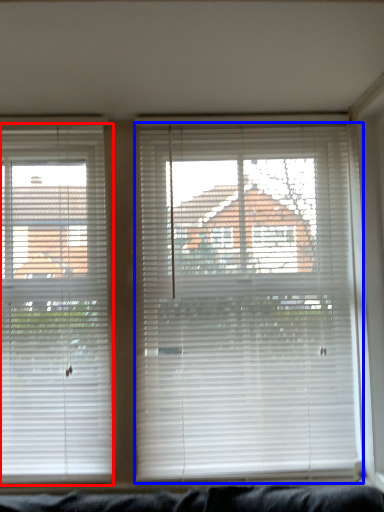
Question: Among these objects, which one is farthest to the camera, window blind (highlighted by a red box) or window blind (highlighted by a blue box)?

Choices:
 (A) window blind
 (B) window blind

Answer: (A)